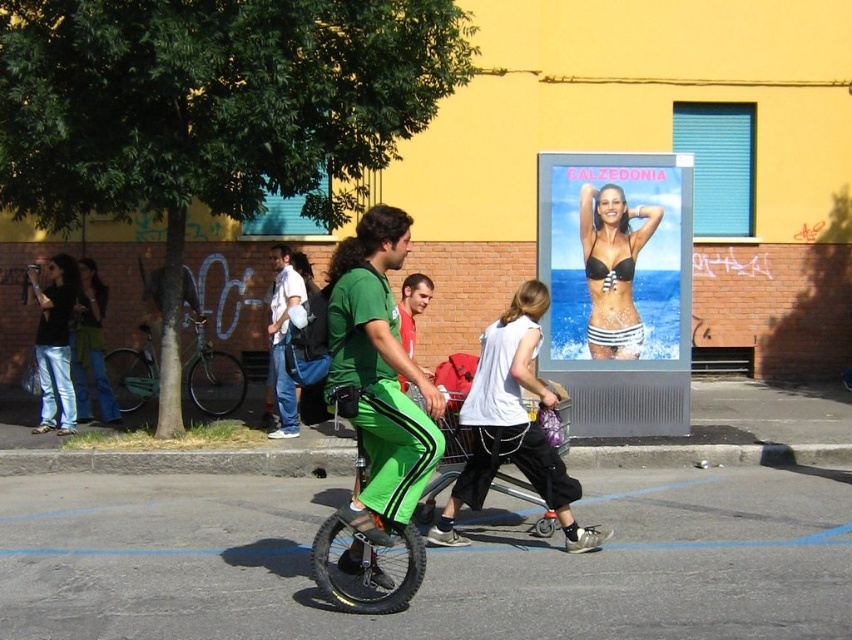
Question: Which of the following is the closest to the observer?

Choices:
 (A) green matte unicycle at center
 (B) black bikini at center

Answer: (A)

Question: Among these points, which one is farthest from the camera?

Choices:
 (A) (350, 364)
 (B) (522, 285)
 (C) (619, 240)

Answer: (C)

Question: Does white matte shirt at center lie in front of matte black camera at left?

Choices:
 (A) no
 (B) yes

Answer: (B)

Question: Does green matte pants at center come in front of white matte shirt at center?

Choices:
 (A) yes
 (B) no

Answer: (A)

Question: Estimate the real-world distances between objects in this image. Which object is farther from the matte black jacket at left?

Choices:
 (A) white cotton shirt at center
 (B) matte black camera at left
 (C) black bikini at center
 (D) black striped bikini top at center

Answer: (C)

Question: Does green matte unicycle at center appear on the left side of matte black jacket at left?

Choices:
 (A) yes
 (B) no

Answer: (B)